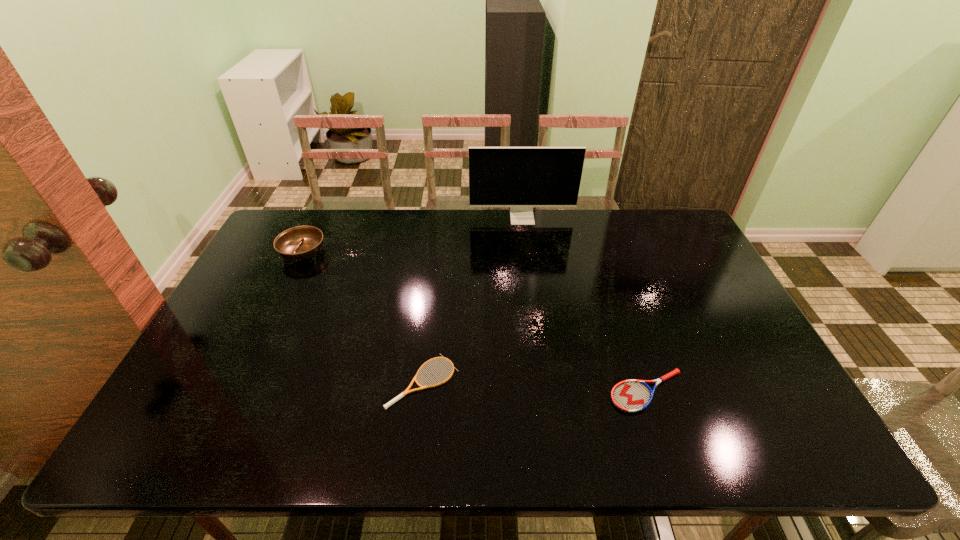
At what (x,y) coordinates should I click in order to perform the action: click on object that is the closest one to the monitor. Please return your answer as a coordinate pair (x, y). This screenshot has height=540, width=960. Looking at the image, I should click on [x=300, y=243].

Locate which object ranks second in proximity to the tallest object. Please provide its 2D coordinates. Your answer should be formatted as a tuple, i.e. [(x, y)], where the tuple contains the x and y coordinates of a point satisfying the conditions above.

[(406, 391)]

Identify the location of vacant region that satisfies the following two spatial constraints: 1. on the front-facing side of the monitor; 2. on the right side of the right tennis racket. This screenshot has width=960, height=540. (543, 391).

Identify the location of free spot that satisfies the following two spatial constraints: 1. on the front side of the soup bowl; 2. on the left side of the second object from left to right. (242, 381).